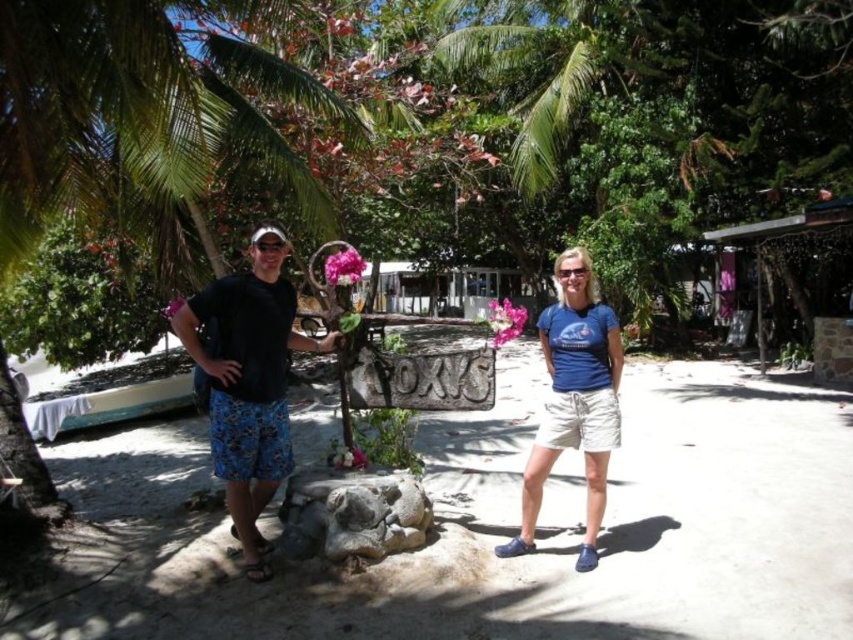
You are a lifeguard on duty at the beach. You notice two pairs of goggles lying on the sand. The black plastic goggles at left and transparent plastic goggles at center are 6.05 feet apart. You need to retrieve them both quickly. Which pair should you grab first to minimize the distance you have to walk?

You should grab the black plastic goggles at left first because they are closer to your starting position than the transparent plastic goggles at center, which are 6.05 feet away.

You are taking a photo of the two people in the scene. You want to focus on the person closer to the camera. Which point should you focus on, point (572, 413) or point (274, 243)?

Point (572, 413) is further to the camera than point (274, 243), so you should focus on point (572, 413) to capture the person closer to the camera.